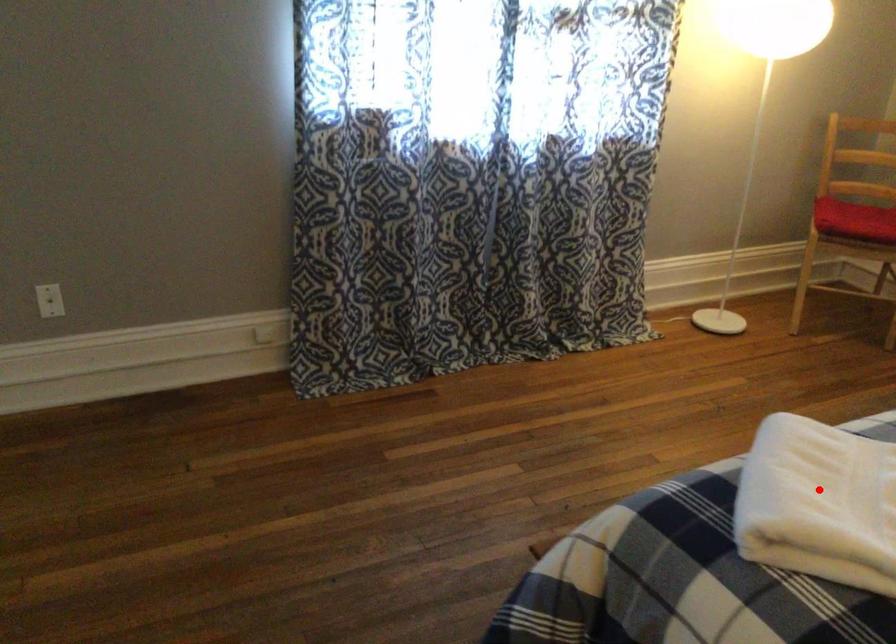
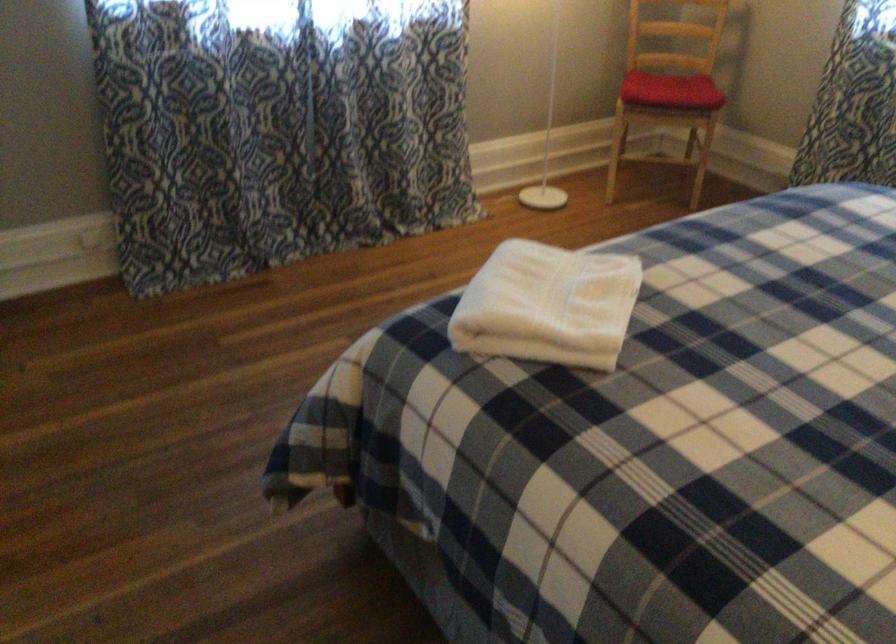
Find the pixel in the second image that matches the highlighted location in the first image.

(547, 305)